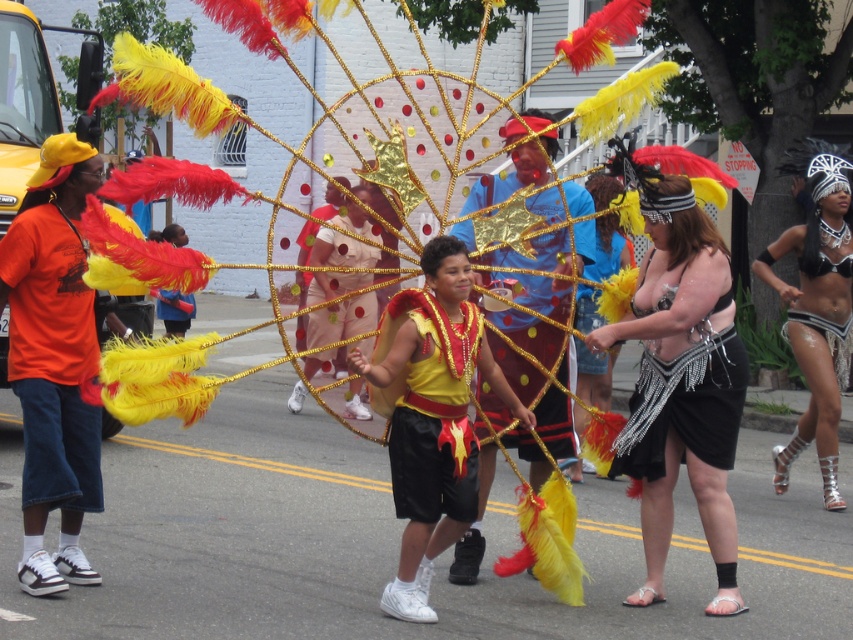
You are a photographer at the parade and want to capture both the gold sequined dress at center and the black sequined bikini at center in a single frame. Which one should you focus on to ensure both are visible without cropping?

You should focus on the gold sequined dress at center because it is larger and will be more visible even if the black sequined bikini at center is smaller in the frame.

You are a photographer at the parade and want to capture both the gold sequined dress at center and the black sequined bikini at center in a single photo. Which one will appear larger in the photo?

The gold sequined dress at center will appear larger in the photo because it is closer to the viewer than the black sequined bikini at center.

You are a photographer at the parade and want to capture both the orange cotton shirt at left and the yellow satin vest at center in a single frame. However, you notice that one of them is partially hidden by the other. Which object is covering part of the other?

The orange cotton shirt at left is positioned over the yellow satin vest at center, so it is covering part of the yellow satin vest at center.